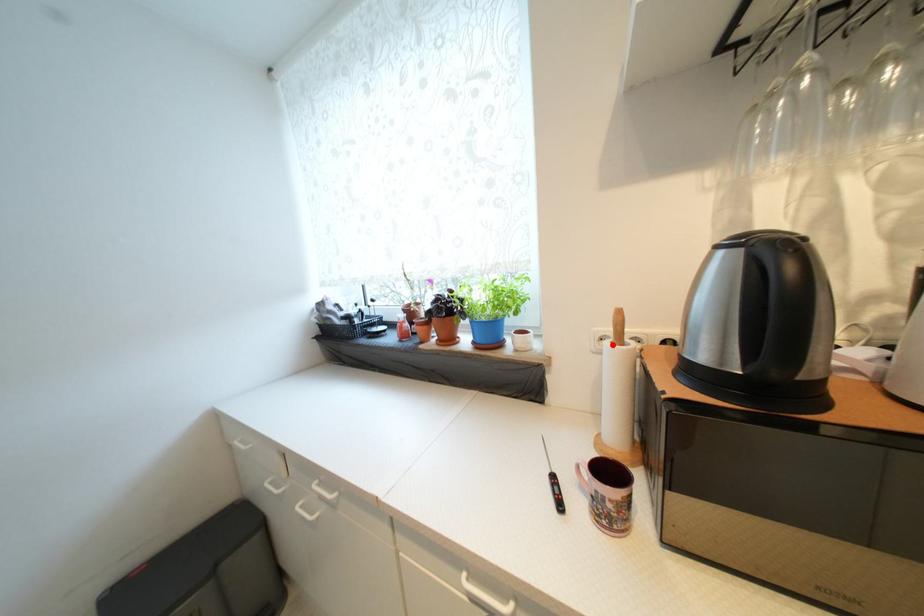
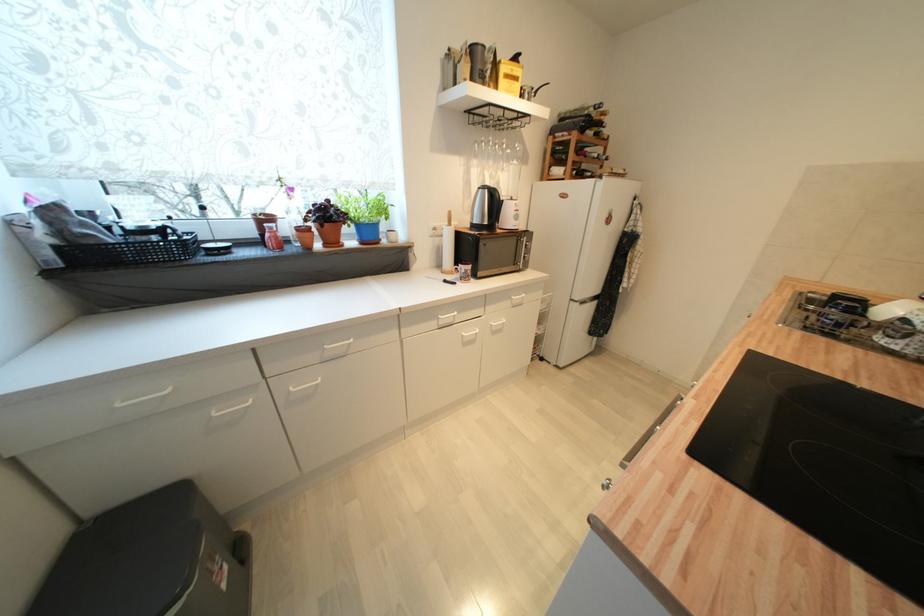
The point at the highlighted location is marked in the first image. Where is the corresponding point in the second image?

(450, 229)